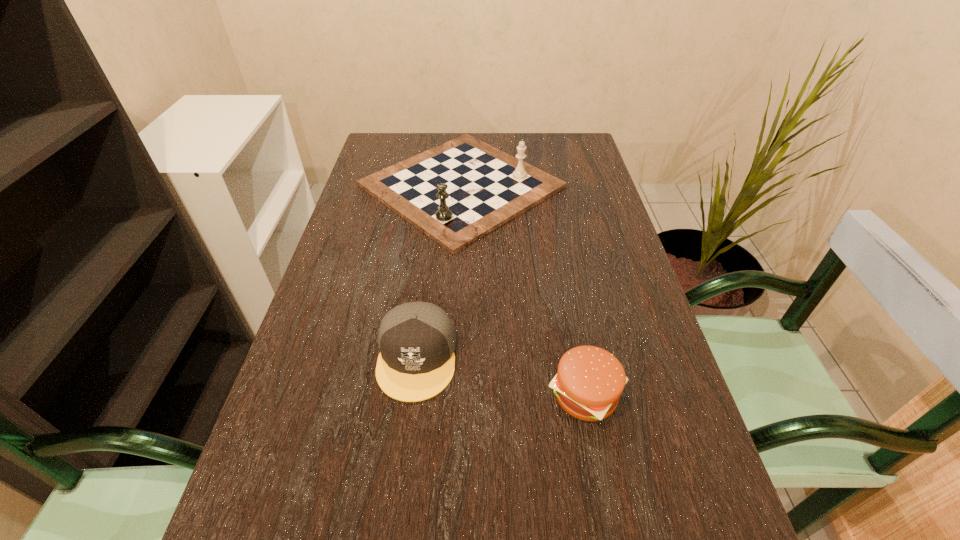
The width and height of the screenshot is (960, 540). In order to click on empty location between the cap and the tallest object in this screenshot , I will do `click(439, 272)`.

Locate which object is the second closest to the hamburger. Please provide its 2D coordinates. Your answer should be formatted as a tuple, i.e. [(x, y)], where the tuple contains the x and y coordinates of a point satisfying the conditions above.

[(457, 192)]

Where is `object that stands as the second closest to the cap`? This screenshot has width=960, height=540. object that stands as the second closest to the cap is located at coordinates (457, 192).

I want to click on vacant space that satisfies the following two spatial constraints: 1. on the front side of the farthest object; 2. on the right side of the hamburger, so click(x=449, y=395).

The image size is (960, 540). In order to click on vacant space that satisfies the following two spatial constraints: 1. on the front-facing side of the hamburger; 2. on the right side of the cap in this screenshot , I will do `click(412, 395)`.